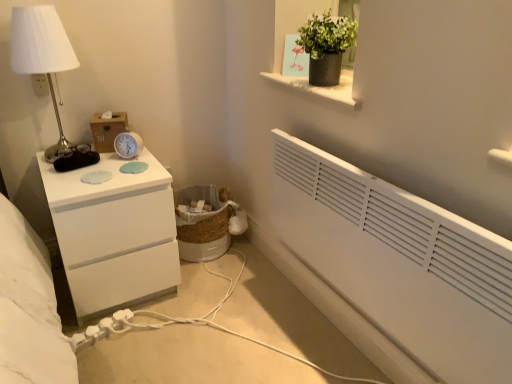
This screenshot has width=512, height=384. I want to click on free spot above white glossy chest of drawers at left (from a real-world perspective), so click(98, 173).